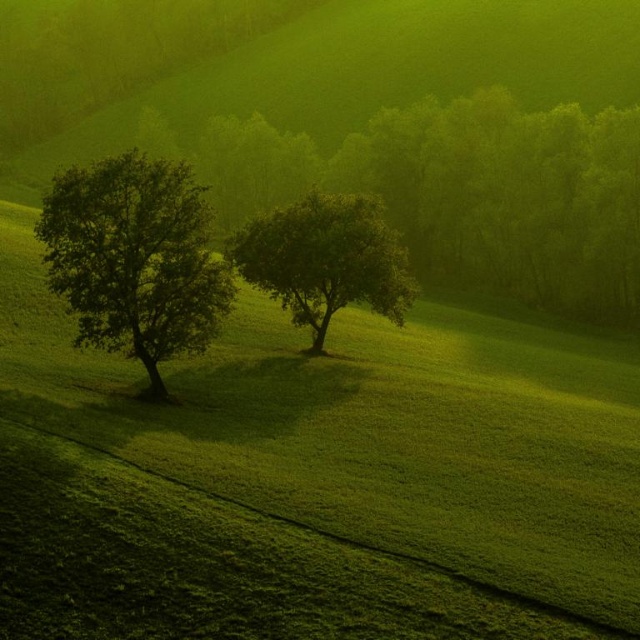
In the scene shown: Can you confirm if green grassy field at center is bigger than green leafy tree at left?

Indeed, green grassy field at center has a larger size compared to green leafy tree at left.

From the picture: Who is shorter, green grassy field at center or green leafy tree at left?

green leafy tree at left is shorter.

This screenshot has height=640, width=640. What do you see at coordinates (314, 477) in the screenshot?
I see `green grassy field at center` at bounding box center [314, 477].

Identify the location of green grassy field at center. (314, 477).

Can you confirm if green grassy field at center is positioned to the right of green leafy tree at center?

Yes, green grassy field at center is to the right of green leafy tree at center.

Who is more forward, (x=634, y=612) or (x=364, y=240)?

Point (x=634, y=612) is in front.

Identify the location of green grassy field at center. The image size is (640, 640). (314, 477).

Between point (168, 220) and point (353, 276), which one is positioned behind?

The point (353, 276) is behind.

Between green leafy tree at left and green leafy tree at center, which one has less height?

With less height is green leafy tree at left.

Which is behind, point (160, 250) or point (260, 280)?

The point (260, 280) is behind.

This screenshot has width=640, height=640. In order to click on green leafy tree at left in this screenshot , I will do pos(134,259).